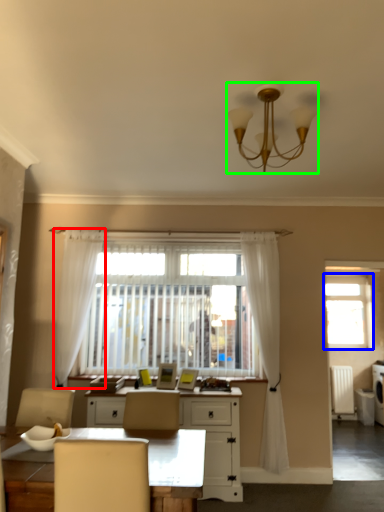
Question: Estimate the real-world distances between objects in this image. Which object is closer to curtain (highlighted by a red box), window (highlighted by a blue box) or lamp (highlighted by a green box)?

Choices:
 (A) window
 (B) lamp

Answer: (B)